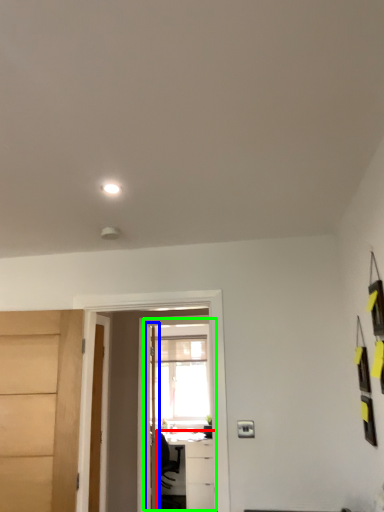
Question: Which object is positioned farthest from table (highlighted by a red box)? Select from door (highlighted by a blue box) and screen door (highlighted by a green box).

Choices:
 (A) door
 (B) screen door

Answer: (A)